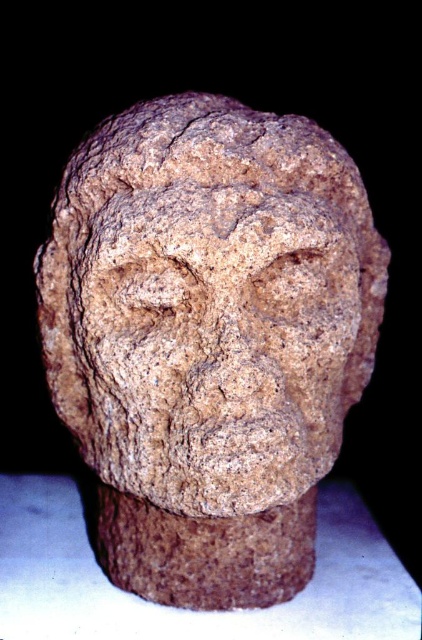
Question: Is brown rough stone head at center wider than rough stone face at center?

Choices:
 (A) no
 (B) yes

Answer: (B)

Question: Does brown rough stone head at center have a larger size compared to rough stone face at center?

Choices:
 (A) yes
 (B) no

Answer: (A)

Question: Does brown rough stone head at center appear on the right side of rough stone face at center?

Choices:
 (A) no
 (B) yes

Answer: (B)

Question: Which point is farther to the camera?

Choices:
 (A) (219, 326)
 (B) (111, 456)

Answer: (B)

Question: Among these objects, which one is nearest to the camera?

Choices:
 (A) brown rough stone head at center
 (B) rough stone face at center

Answer: (B)

Question: Which point is farther to the camera?

Choices:
 (A) (235, 300)
 (B) (254, 230)

Answer: (A)